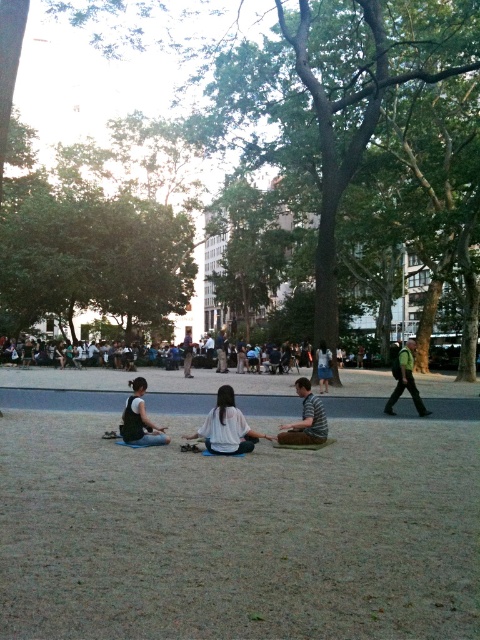
Question: Estimate the real-world distances between objects in this image. Which object is closer to the denim pants at center?

Choices:
 (A) matte black vest at center
 (B) green leafy tree at center

Answer: (A)

Question: Can you confirm if striped cotton shirt at center is positioned below light brown wooden bench at center?

Choices:
 (A) yes
 (B) no

Answer: (A)

Question: Which point is closer to the camera taking this photo?

Choices:
 (A) (408, 378)
 (B) (247, 429)
 (C) (182, 353)

Answer: (B)

Question: Is white cotton shirt at center closer to the viewer compared to matte black vest at center?

Choices:
 (A) no
 (B) yes

Answer: (B)

Question: From the image, what is the correct spatial relationship of matte black vest at center in relation to green fabric pants at lower right?

Choices:
 (A) left
 (B) right

Answer: (A)

Question: Which object is the farthest from the dark gray fabric at center?

Choices:
 (A) green leafy tree at center
 (B) green fabric pants at lower right
 (C) light brown wooden bench at center

Answer: (B)